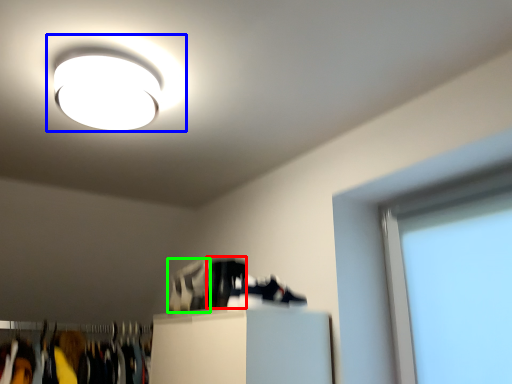
Question: Which object is positioned farthest from shoe (highlighted by a red box)? Select from lamp (highlighted by a blue box) and shoe (highlighted by a green box).

Choices:
 (A) lamp
 (B) shoe

Answer: (A)